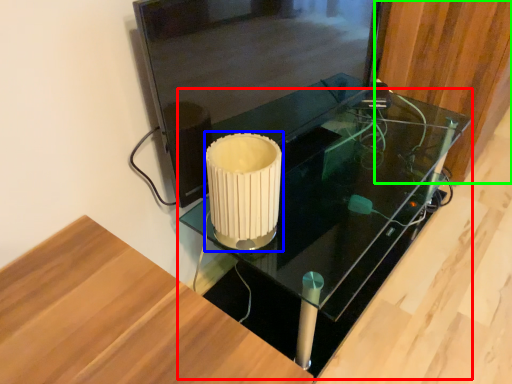
Question: Considering the real-world distances, which object is farthest from table (highlighted by a red box)? candle holder (highlighted by a blue box) or wood (highlighted by a green box)?

Choices:
 (A) candle holder
 (B) wood

Answer: (A)